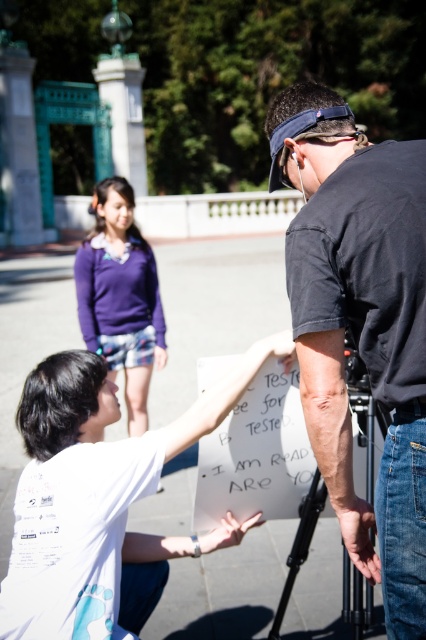
Between black matte shirt at center and black matte tripod at lower center, which one has more height?

black matte shirt at center

Who is positioned more to the right, black matte shirt at center or black matte tripod at lower center?

black matte shirt at center is more to the right.

Between point (347, 444) and point (307, 524), which one is positioned behind?

The point (307, 524) is behind.

At what (x,y) coordinates should I click in order to perform the action: click on black matte shirt at center. Please return your answer as a coordinate pair (x, y). Looking at the image, I should click on (359, 323).

Is black matte shirt at center smaller than purple fabric shorts at center?

Indeed, black matte shirt at center has a smaller size compared to purple fabric shorts at center.

Who is positioned more to the left, black matte shirt at center or purple fabric shorts at center?

From the viewer's perspective, purple fabric shorts at center appears more on the left side.

Which is behind, point (350, 480) or point (123, 184)?

Positioned behind is point (123, 184).

Find the location of a particular element. This screenshot has width=426, height=640. black matte shirt at center is located at coordinates (359, 323).

Can you confirm if purple fabric shorts at center is positioned below black matte tripod at lower center?

No, purple fabric shorts at center is not below black matte tripod at lower center.

Which is in front, point (89, 289) or point (294, 538)?

Positioned in front is point (294, 538).

The image size is (426, 640). What are the coordinates of `purple fabric shorts at center` in the screenshot? It's located at (120, 298).